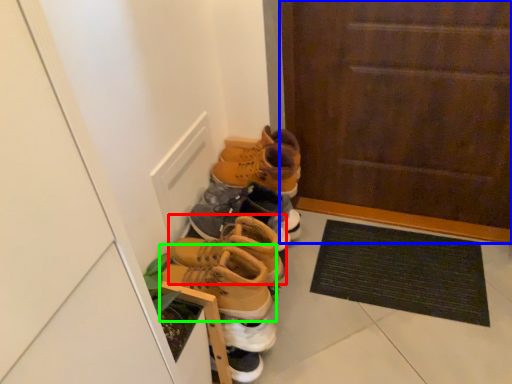
Question: Which object is the closest to the footwear (highlighted by a red box)? Choose among these: door (highlighted by a blue box) or footwear (highlighted by a green box).

Choices:
 (A) door
 (B) footwear

Answer: (B)